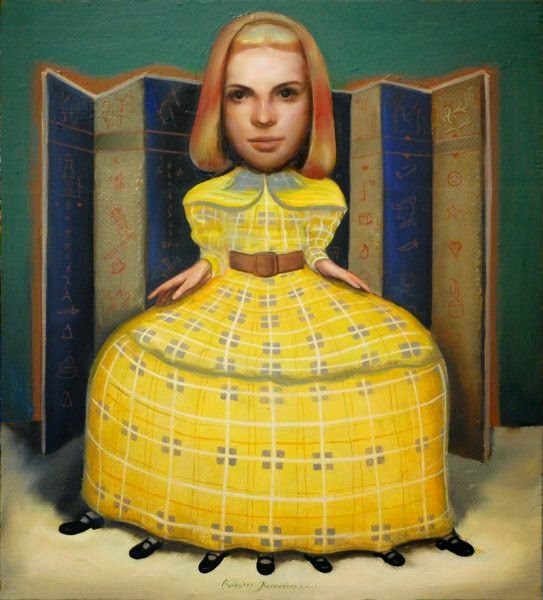
The height and width of the screenshot is (600, 543). I want to click on wall, so click(x=169, y=27).